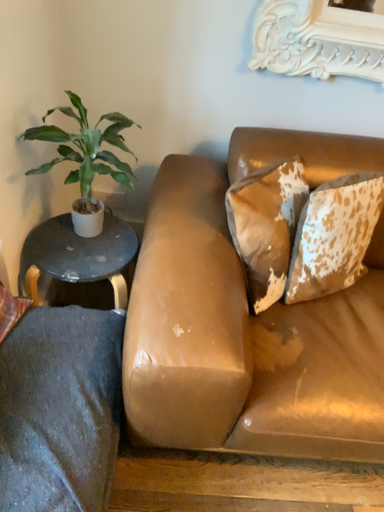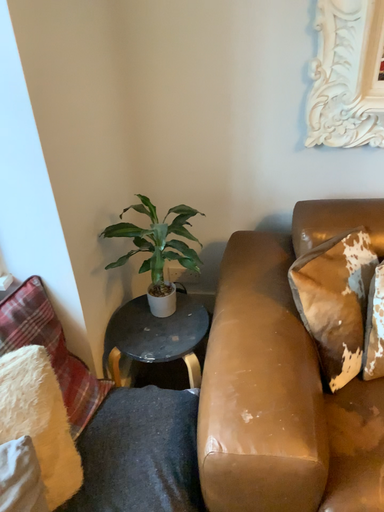
Question: Which way did the camera rotate in the video?

Choices:
 (A) rotated upward
 (B) rotated downward

Answer: (A)